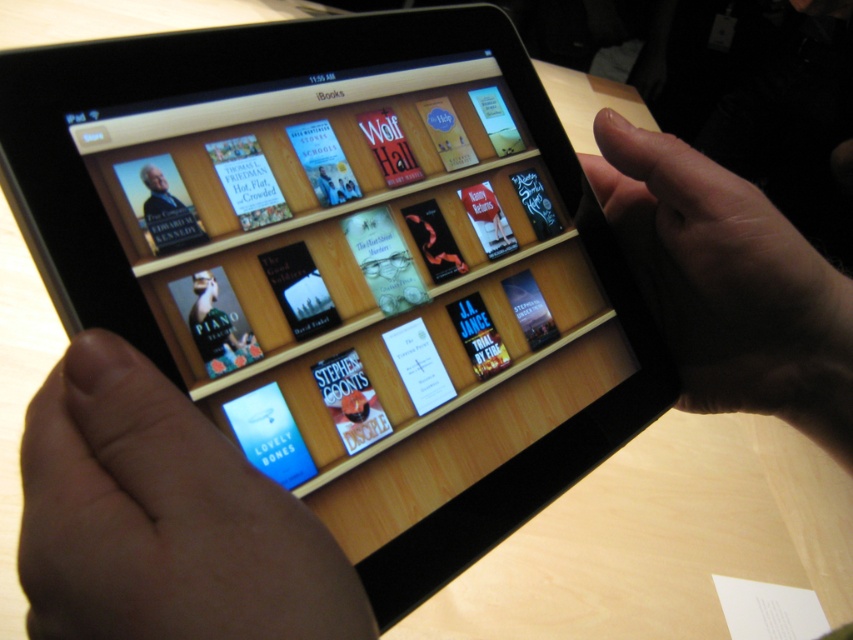
Question: Can you confirm if smooth skin hand at lower left is thinner than skinny finger at upper right?

Choices:
 (A) yes
 (B) no

Answer: (A)

Question: Which point is farther to the camera?

Choices:
 (A) smooth skin hand at lower left
 (B) matte paper book at center
 (C) skinny finger at upper right

Answer: (C)

Question: Can you confirm if smooth skin hand at lower left is positioned to the right of skinny finger at upper right?

Choices:
 (A) no
 (B) yes

Answer: (A)

Question: Which point is farther from the camera taking this photo?

Choices:
 (A) (247, 337)
 (B) (712, 176)
 (C) (339, 566)

Answer: (B)

Question: Is smooth skin hand at lower left further to the viewer compared to matte paper book at center?

Choices:
 (A) no
 (B) yes

Answer: (A)

Question: Which of the following is the closest to the observer?

Choices:
 (A) smooth skin hand at lower left
 (B) matte paper book at center

Answer: (A)